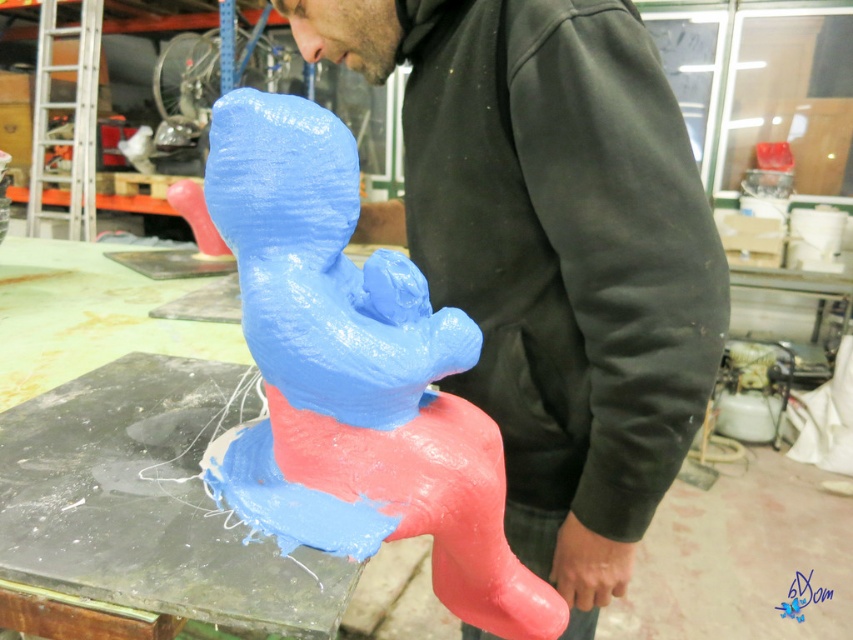
Question: Which point is farther to the camera?

Choices:
 (A) (357, 166)
 (B) (660, 184)

Answer: (B)

Question: From the image, what is the correct spatial relationship of matte black hoodie at center in relation to matte plastic toy at center?

Choices:
 (A) left
 (B) right

Answer: (B)

Question: Can you confirm if matte black hoodie at center is smaller than matte plastic toy at center?

Choices:
 (A) no
 (B) yes

Answer: (A)

Question: Where is matte black hoodie at center located in relation to matte plastic toy at center in the image?

Choices:
 (A) above
 (B) below

Answer: (A)